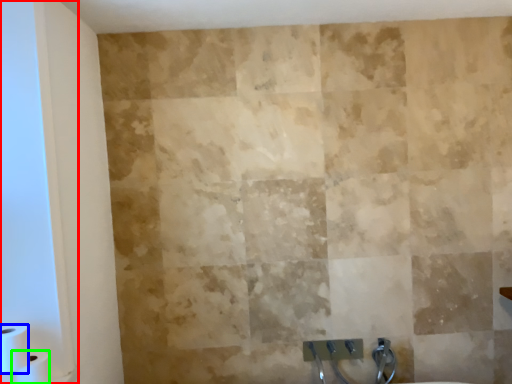
Question: Which object is the closest to the glass door (highlighted by a red box)? Choose among these: toilet paper (highlighted by a blue box) or toilet paper (highlighted by a green box).

Choices:
 (A) toilet paper
 (B) toilet paper

Answer: (A)